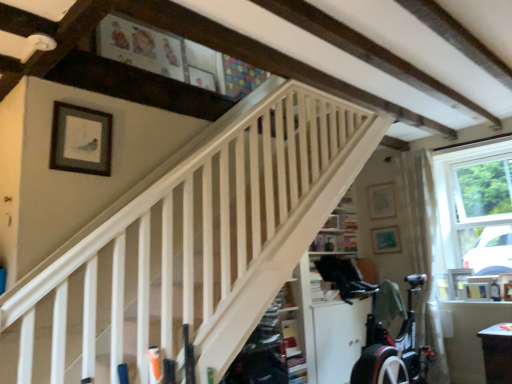
Locate an element on the screen. The image size is (512, 384). free space to the left of matte black picture frame at lower right, placed as the 4th picture frame when sorted from back to front is located at coordinates (459, 301).